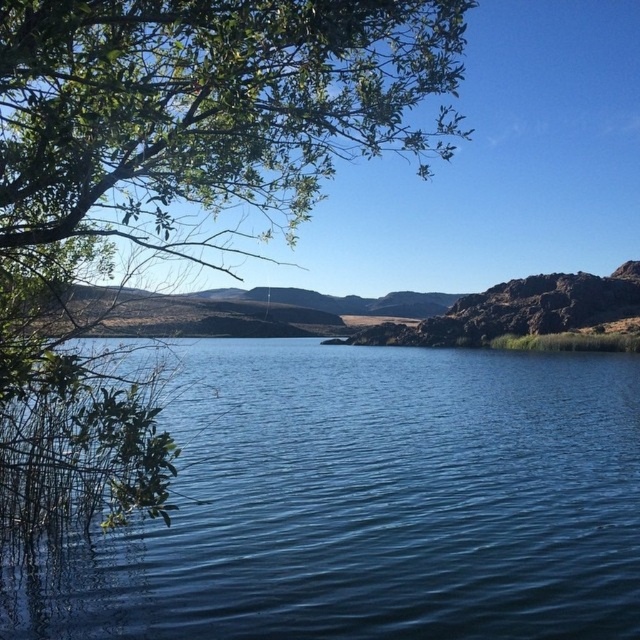
Question: In this image, where is blue liquid water at center located relative to green leafy tree at upper left?

Choices:
 (A) above
 (B) below

Answer: (B)

Question: Which object appears farthest from the camera in this image?

Choices:
 (A) blue liquid water at center
 (B) green leafy tree at upper left

Answer: (A)

Question: Is blue liquid water at center in front of green leafy tree at upper left?

Choices:
 (A) yes
 (B) no

Answer: (B)

Question: Among these objects, which one is nearest to the camera?

Choices:
 (A) blue liquid water at center
 (B) green leafy tree at upper left

Answer: (B)

Question: Can you confirm if blue liquid water at center is positioned to the right of green leafy tree at upper left?

Choices:
 (A) no
 (B) yes

Answer: (B)